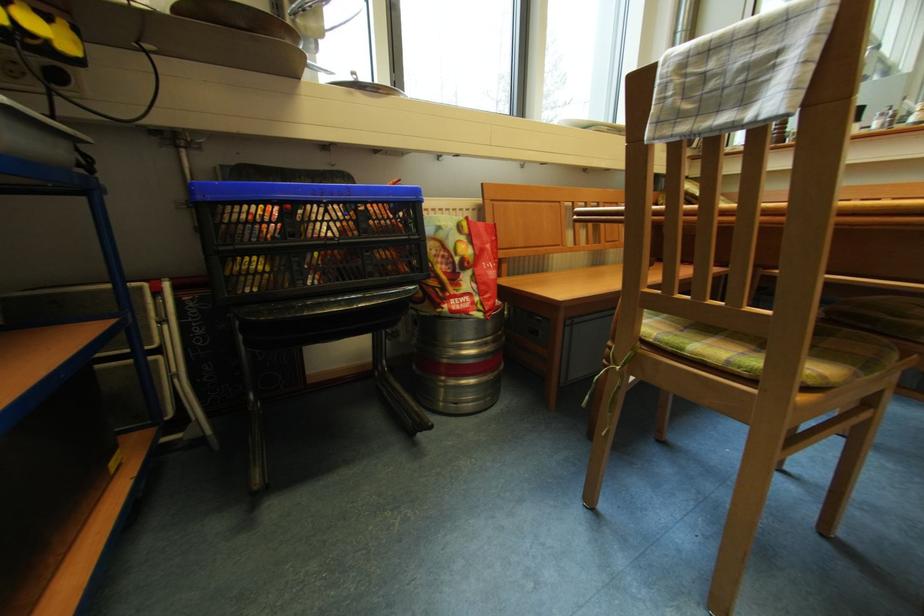
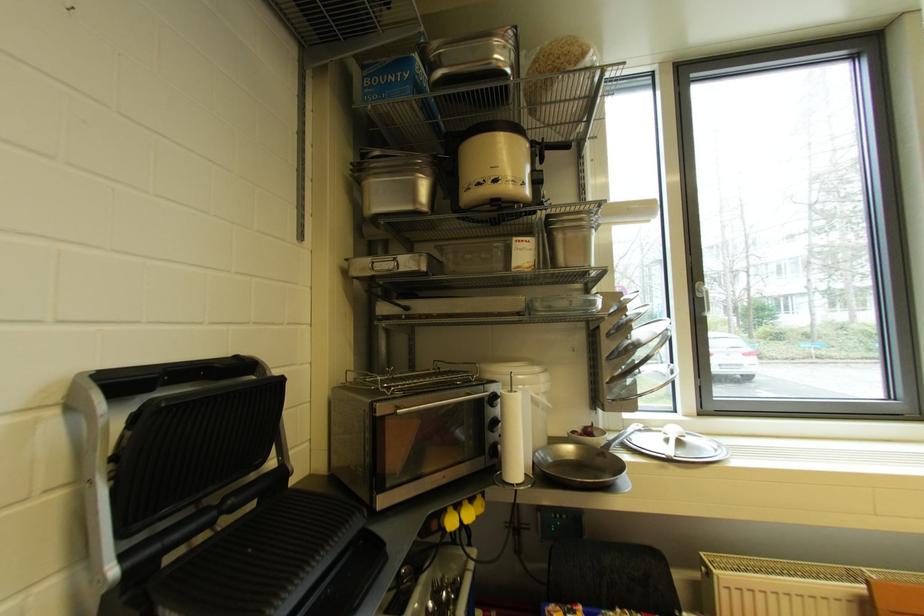
The images are taken continuously from a first-person perspective. In which direction is your viewpoint rotating?

The camera rotated toward left-up.